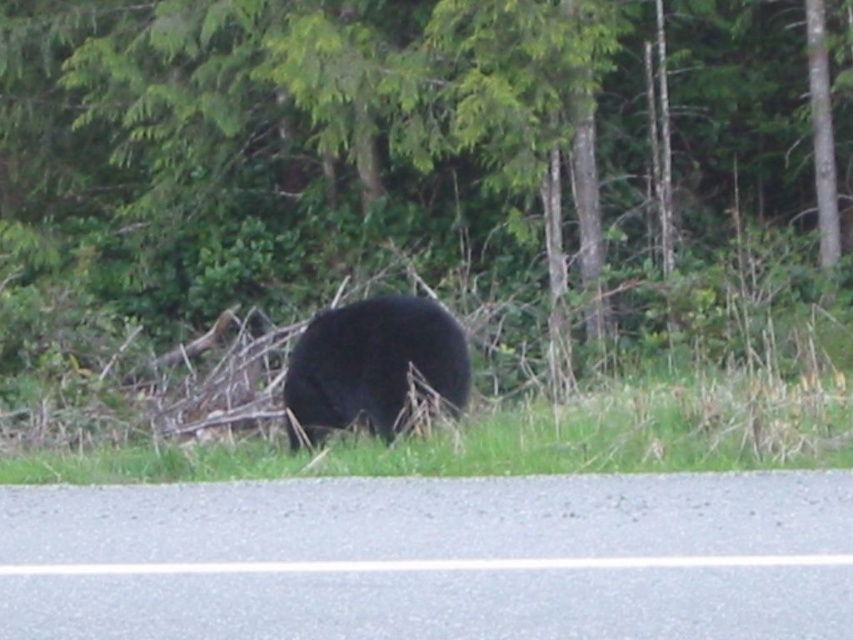
You are a hiker trying to locate two points marked in the image. The first point is at coordinate point (177, 13), and the second is at point (357, 378). Which point is closer to you as you view the scene?

Point (177, 13) is closer to you than point (357, 378) because it is further to the viewer than the other point.

You are a hiker trying to take a photo of the black furry bear at center without getting too close. You notice a green leafy tree at center in the background. Can you position yourself behind the tree to take a safer shot? Explain why or why not based on their sizes.

The green leafy tree at center is taller than the black furry bear at center, so positioning yourself behind the tree would provide enough height to safely take a photo without the bear noticing you.

In the scene shown: You are a hiker standing at the point marked by the coordinates point (407, 141). Looking towards the dense forest of coniferous trees in the background, which direction should you walk to reach the black bear grazing near the edge of the road?

The point (407, 141) marks green leafy tree at center. The black bear is near the edge of the road, which is in the foreground. To reach the bear from the green leafy tree at center, you should walk towards the foreground, which would be downward in the image perspective.